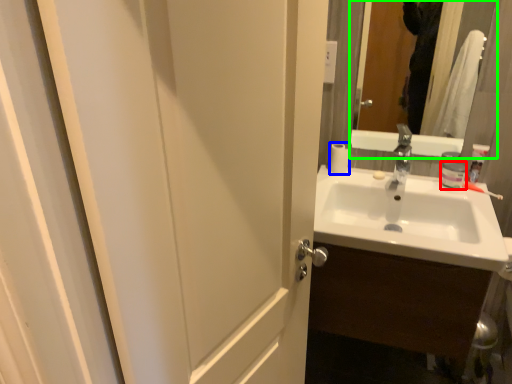
Question: Based on their relative distances, which object is farther from toiletry (highlighted by a red box)? Choose from toilet paper (highlighted by a blue box) and mirror (highlighted by a green box).

Choices:
 (A) toilet paper
 (B) mirror

Answer: (B)